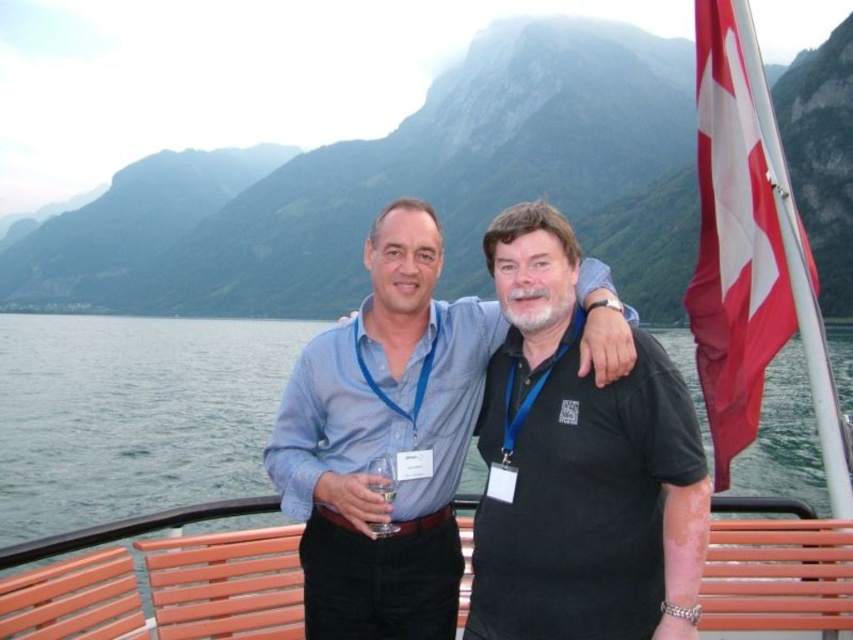
Question: Considering the real-world distances, which object is closest to the matte black water at center?

Choices:
 (A) black matte shirt at center
 (B) transparent water at bench left
 (C) red fabric flag at right
 (D) blue cotton shirt at center

Answer: (B)

Question: Can you confirm if transparent water at bench left is positioned below red fabric flag at right?

Choices:
 (A) yes
 (B) no

Answer: (A)

Question: Is blue cotton shirt at center to the left of red fabric flag at right from the viewer's perspective?

Choices:
 (A) no
 (B) yes

Answer: (B)

Question: Is matte black water at center positioned behind blue cotton shirt at center?

Choices:
 (A) yes
 (B) no

Answer: (A)

Question: Which of these objects is positioned closest to the black matte shirt at center?

Choices:
 (A) red fabric flag at right
 (B) blue cotton shirt at center
 (C) matte black water at center
 (D) transparent water at bench left

Answer: (B)

Question: Which point appears farthest from the camera in this image?

Choices:
 (A) (556, 320)
 (B) (283, 417)
 (C) (171, 468)
 (D) (79, 301)

Answer: (D)